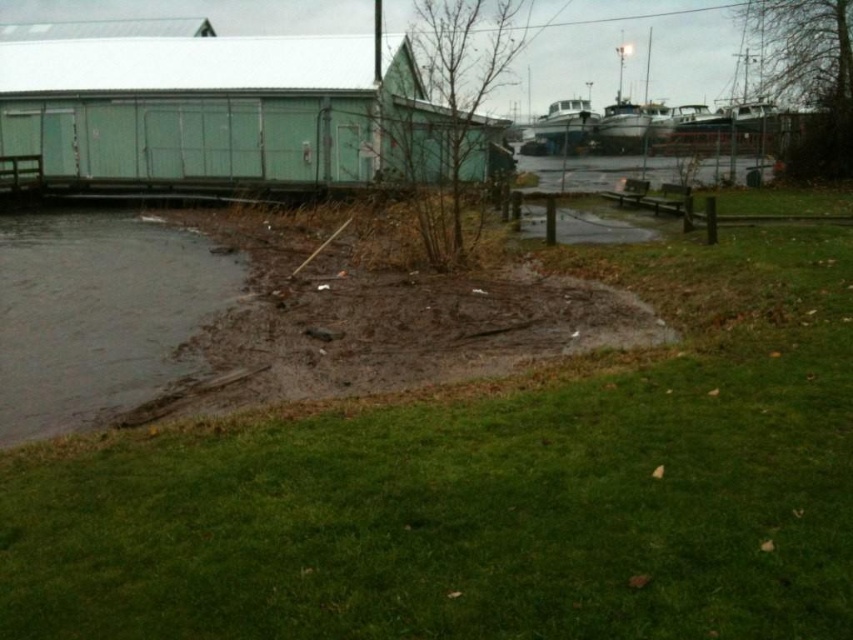
You are a hiker trying to cross from the grassy area to the clear water at center without getting your shoes dirty. The dark gray mud at lower left is in your path. Can you walk around it? Explain your reasoning based on the scene description.

The dark gray mud at lower left is closer to the viewer than the clear water at center, so you can walk around it by going either to the right or left of the mud to reach the clear water at center without stepping into the mud.

You are a delivery person needing to reach the green matte shed at upper left. The flooded area is 40 feet wide. Can you safely walk through the flooded area to reach the shed?

The green matte shed at upper left is 44.68 feet from the camera. Since the flooded area is only 40 feet wide, you would need to walk through 4.68 feet of dry land before reaching the shed, so it is safe to proceed.